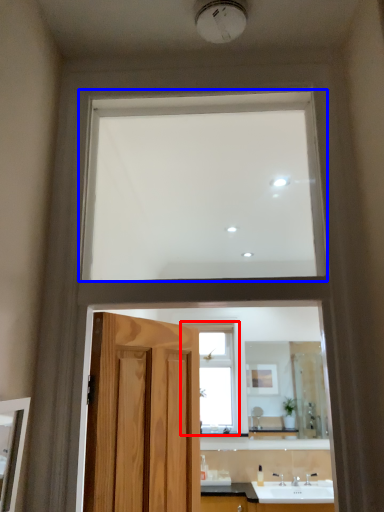
Question: Which point is further to the camera, window (highlighted by a red box) or window (highlighted by a blue box)?

Choices:
 (A) window
 (B) window

Answer: (A)